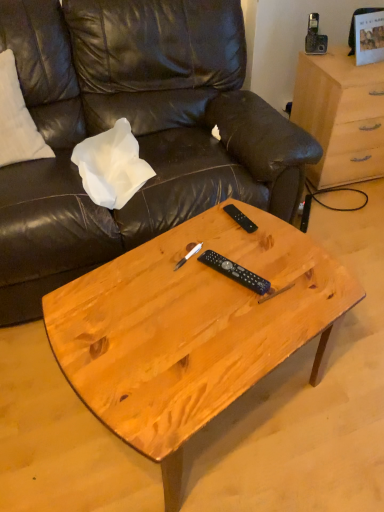
Identify the location of free spot to the left of black plastic remote at center, the 1th remote positioned from the bottom. (172, 281).